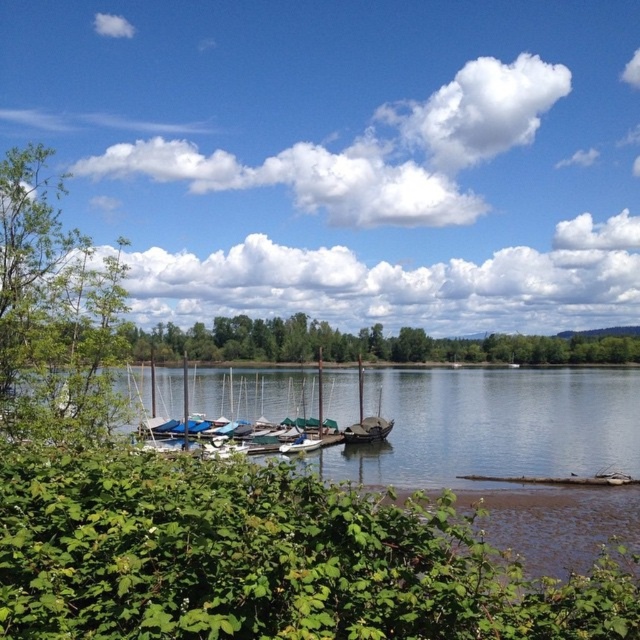
Between point (22, 266) and point (362, 364), which one is positioned in front?

Positioned in front is point (22, 266).

Can you confirm if green leafy tree at left is taller than dark brown wooden sailboat at center?

Incorrect, green leafy tree at left's height is not larger of dark brown wooden sailboat at center's.

Between point (44, 212) and point (360, 429), which one is positioned behind?

The point (360, 429) is more distant.

I want to click on green leafy tree at left, so click(52, 310).